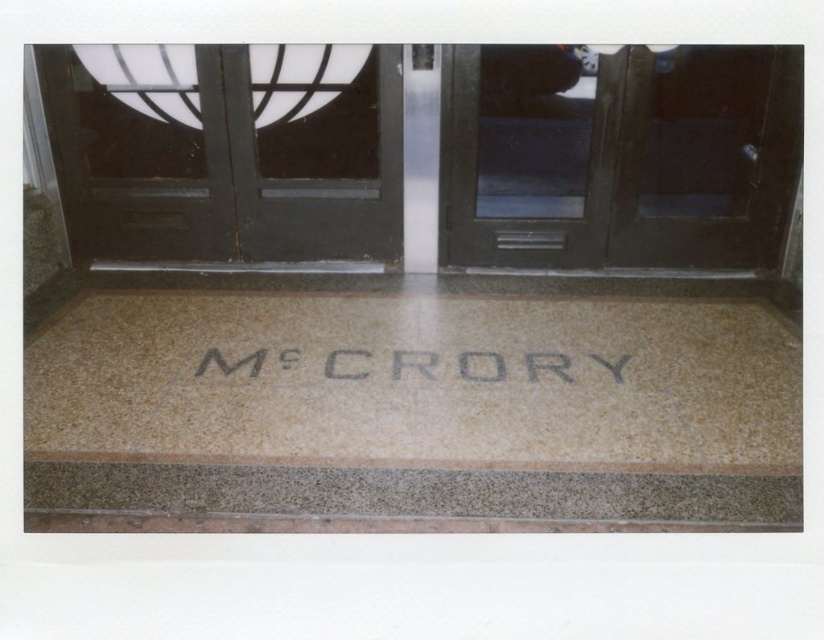
You are a delivery person with a cart that is 1.5 meters wide. You need to move through the entrance and go through the clear glass door at center. Is your cart wide enough to pass through the doorway?

The clear glass door at center and camera are 3.76 meters apart. Since the cart is 1.5 meters wide, it can easily pass through the doorway as the distance between the clear glass door at center and the camera is sufficient.

You are a delivery person trying to enter the building through the doors. You notice two doors in front of you, a clear glass door at center and a matte black door at center. Which door should you open to enter the building?

The clear glass door at center is much taller than the matte black door at center, so you should open the clear glass door at center to enter the building since it is likely the main entrance.

You are standing at the entrance of the building and see two points marked on the floor. The first point is at coordinate point (342, 116) and the second is at point (577, 237). Based on the scene description, which point is closer to the double doors?

Point (342, 116) is in front of point (577, 237), so it is closer to the double doors.